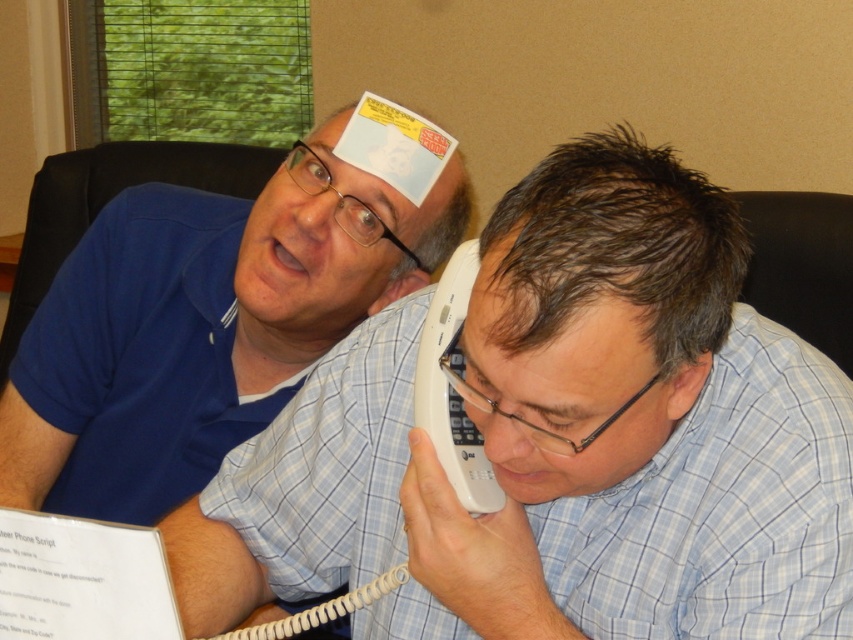
Question: Does blue shirt at upper left appear on the left side of matte blue shirt at upper left?

Choices:
 (A) no
 (B) yes

Answer: (A)

Question: Which of the following is the farthest from the observer?

Choices:
 (A) (299, 524)
 (B) (241, 388)

Answer: (B)

Question: Which object appears farthest from the camera in this image?

Choices:
 (A) blue shirt at upper left
 (B) matte blue shirt at upper left

Answer: (B)

Question: Does blue shirt at upper left lie behind matte blue shirt at upper left?

Choices:
 (A) yes
 (B) no

Answer: (B)

Question: Is blue shirt at upper left positioned at the back of matte blue shirt at upper left?

Choices:
 (A) no
 (B) yes

Answer: (A)